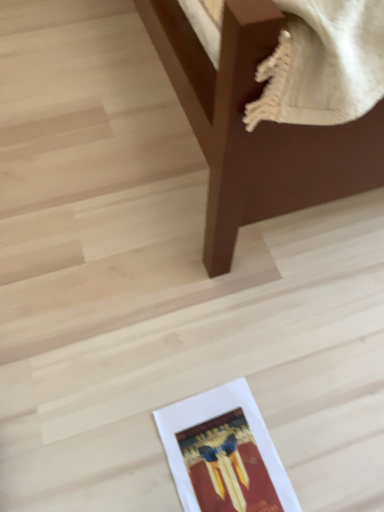
At what (x,y) coordinates should I click in order to perform the action: click on vacant space behind matte paper paperback book at lower center. Please return your answer as a coordinate pair (x, y). Looking at the image, I should click on (221, 353).